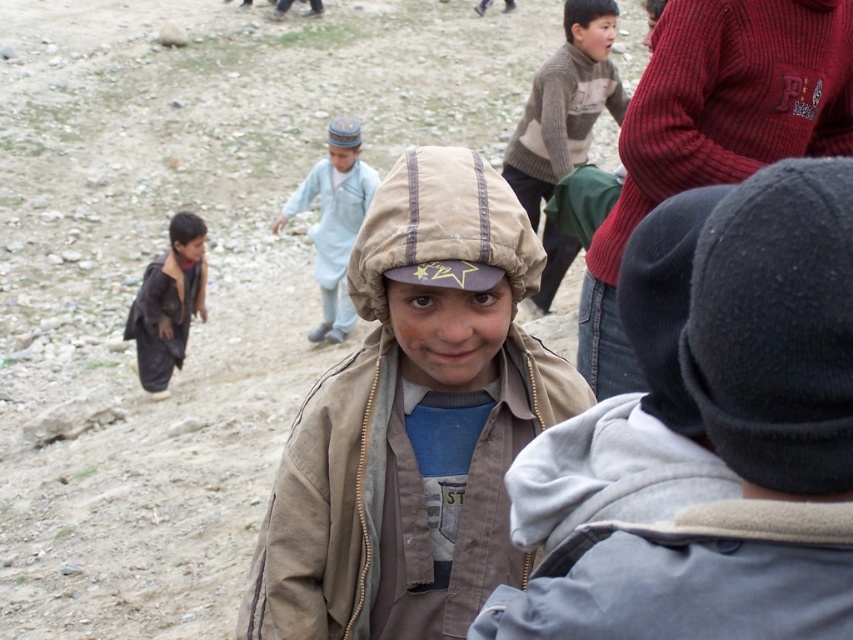
Question: Among these points, which one is farthest from the camera?

Choices:
 (A) (142, 317)
 (B) (315, 250)
 (C) (384, 232)
 (D) (526, 164)

Answer: (B)

Question: Which point is farther to the camera?

Choices:
 (A) light blue fabric dress at center
 (B) knitted sweater at upper center

Answer: (A)

Question: Can you confirm if brown fabric hat at center is positioned above light blue fabric dress at center?

Choices:
 (A) yes
 (B) no

Answer: (B)

Question: Is knitted sweater at upper center further to the viewer compared to light blue fabric dress at center?

Choices:
 (A) yes
 (B) no

Answer: (B)

Question: Which object is closer to the camera taking this photo?

Choices:
 (A) light blue fabric dress at center
 (B) brown fabric hat at center

Answer: (B)

Question: Can you confirm if brown fabric hat at center is smaller than knitted wool sweater at upper center?

Choices:
 (A) yes
 (B) no

Answer: (A)